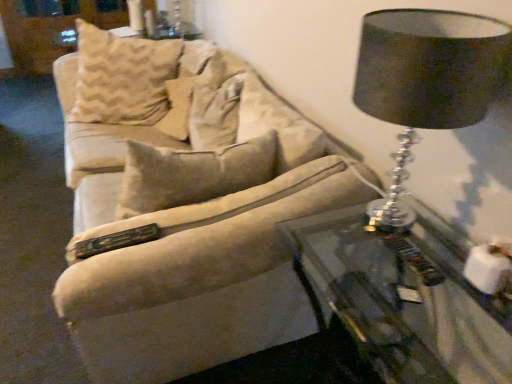
Question: From the image's perspective, is beige fabric pillow at center located beneath white fabric dresser at upper left?

Choices:
 (A) yes
 (B) no

Answer: (A)

Question: Does beige fabric pillow at center have a greater width compared to white fabric dresser at upper left?

Choices:
 (A) no
 (B) yes

Answer: (B)

Question: Does beige fabric pillow at center have a smaller size compared to white fabric dresser at upper left?

Choices:
 (A) no
 (B) yes

Answer: (A)

Question: Is beige fabric pillow at center shorter than white fabric dresser at upper left?

Choices:
 (A) no
 (B) yes

Answer: (B)

Question: Is beige fabric pillow at center to the right of white fabric dresser at upper left from the viewer's perspective?

Choices:
 (A) yes
 (B) no

Answer: (A)

Question: Is black fabric lampshade at upper right taller or shorter than transparent glass table at lower right?

Choices:
 (A) tall
 (B) short

Answer: (B)

Question: Based on their sizes in the image, would you say black fabric lampshade at upper right is bigger or smaller than transparent glass table at lower right?

Choices:
 (A) big
 (B) small

Answer: (B)

Question: Is black fabric lampshade at upper right in front of or behind transparent glass table at lower right in the image?

Choices:
 (A) front
 (B) behind

Answer: (B)

Question: From the image's perspective, relative to transparent glass table at lower right, is black fabric lampshade at upper right above or below?

Choices:
 (A) above
 (B) below

Answer: (A)

Question: From a real-world perspective, is transparent glass table at lower right positioned above or below white fabric dresser at upper left?

Choices:
 (A) above
 (B) below

Answer: (A)

Question: From the image's perspective, is transparent glass table at lower right above or below white fabric dresser at upper left?

Choices:
 (A) below
 (B) above

Answer: (A)

Question: Looking at their shapes, would you say transparent glass table at lower right is wider or thinner than white fabric dresser at upper left?

Choices:
 (A) thin
 (B) wide

Answer: (B)

Question: Considering the relative positions of transparent glass table at lower right and white fabric dresser at upper left in the image provided, is transparent glass table at lower right to the left or to the right of white fabric dresser at upper left?

Choices:
 (A) right
 (B) left

Answer: (A)

Question: Considering the positions of beige fabric pillow at center and black fabric lampshade at upper right in the image, is beige fabric pillow at center taller or shorter than black fabric lampshade at upper right?

Choices:
 (A) tall
 (B) short

Answer: (B)

Question: Is beige fabric pillow at center inside or outside of black fabric lampshade at upper right?

Choices:
 (A) inside
 (B) outside

Answer: (B)